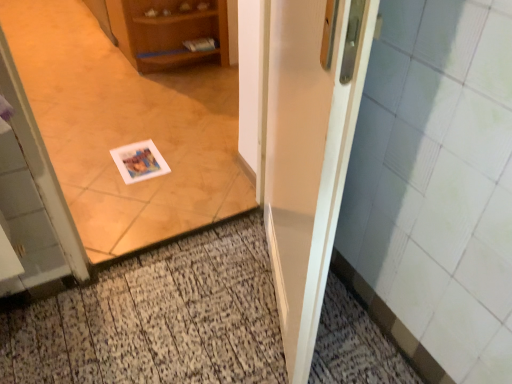
Locate an element on the screen. vacant space that is in between white glossy door at center and white paper at center is located at coordinates (216, 297).